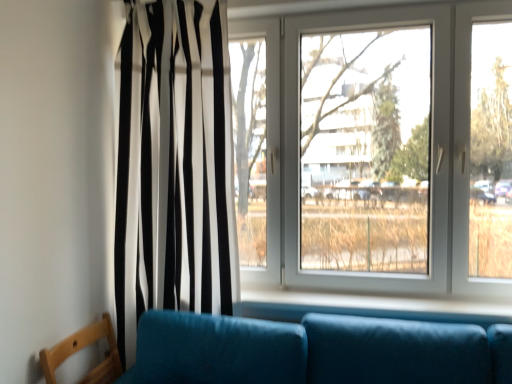
Question: Considering the positions of black/white striped curtain at left and white smooth window sill at lower center in the image, is black/white striped curtain at left wider or thinner than white smooth window sill at lower center?

Choices:
 (A) wide
 (B) thin

Answer: (A)

Question: Is black/white striped curtain at left inside or outside of white smooth window sill at lower center?

Choices:
 (A) inside
 (B) outside

Answer: (B)

Question: Based on their relative distances, which object is nearer to the wooden chair at lower left?

Choices:
 (A) black/white striped curtain at left
 (B) white smooth window sill at lower center
 (C) white plastic window at center

Answer: (A)

Question: Based on their relative distances, which object is farther from the white smooth window sill at lower center?

Choices:
 (A) black/white striped curtain at left
 (B) white plastic window at center
 (C) wooden chair at lower left

Answer: (C)